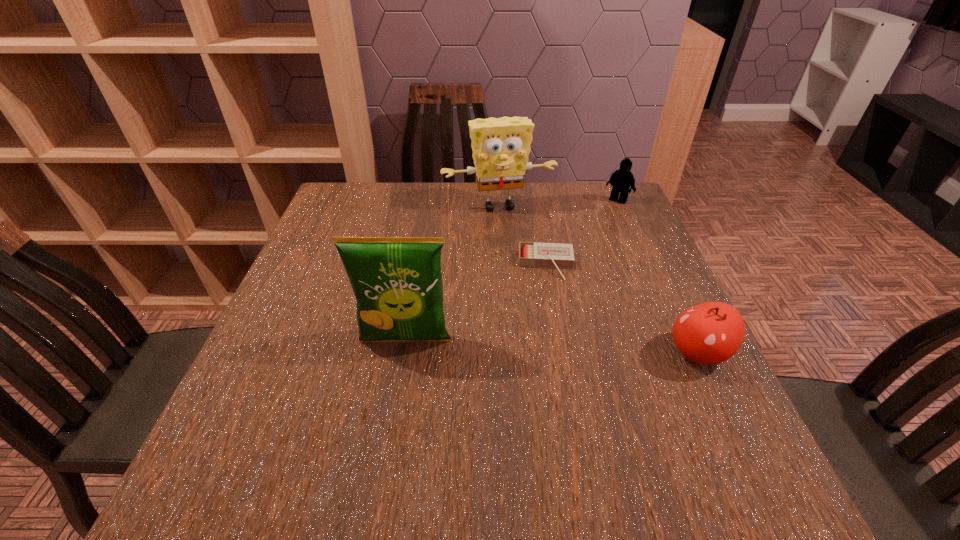
Where is `crisp (potato chip)`? crisp (potato chip) is located at coordinates (397, 281).

Find the location of a particular element. The height and width of the screenshot is (540, 960). apple is located at coordinates (709, 333).

Identify the location of sponge. (501, 146).

Locate an element on the screen. The height and width of the screenshot is (540, 960). matchbox is located at coordinates (531, 254).

Locate an element on the screen. This screenshot has height=540, width=960. the shortest object is located at coordinates (531, 254).

At what (x,y) coordinates should I click in order to perform the action: click on Lego. Please return your answer as a coordinate pair (x, y). This screenshot has height=540, width=960. Looking at the image, I should click on (622, 179).

Identify the location of free spot located on the front-facing side of the crisp (potato chip). (393, 417).

Locate an element on the screen. The image size is (960, 540). free spot located on the left of the apple is located at coordinates (631, 353).

I want to click on vacant space located on the face of the sponge, so click(544, 316).

I want to click on free space located 0.280m on the face of the sponge, so click(x=533, y=283).